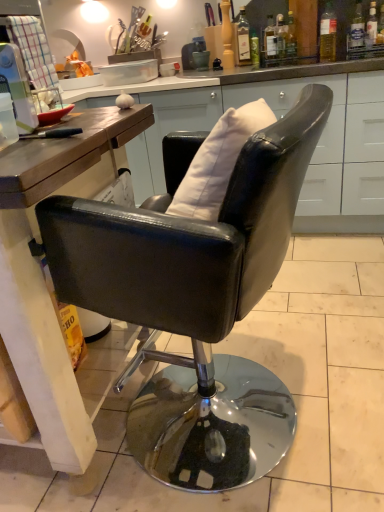
Question: Considering the relative sizes of clear glass bottle at upper right, which is the 2th bottle in right-to-left order, and black leather chair at center in the image provided, is clear glass bottle at upper right, which is the 2th bottle in right-to-left order, bigger than black leather chair at center?

Choices:
 (A) yes
 (B) no

Answer: (B)

Question: Does clear glass bottle at upper right, which ranks as the seventh bottle in left-to-right order, have a smaller size compared to black leather chair at center?

Choices:
 (A) no
 (B) yes

Answer: (B)

Question: Considering the relative positions of clear glass bottle at upper right, which ranks as the seventh bottle in left-to-right order, and black leather chair at center in the image provided, is clear glass bottle at upper right, which ranks as the seventh bottle in left-to-right order, to the left of black leather chair at center from the viewer's perspective?

Choices:
 (A) yes
 (B) no

Answer: (B)

Question: From a real-world perspective, is clear glass bottle at upper right, which ranks as the seventh bottle in left-to-right order, located higher than black leather chair at center?

Choices:
 (A) yes
 (B) no

Answer: (A)

Question: From the image's perspective, is clear glass bottle at upper right, which is the 2th bottle in right-to-left order, located above black leather chair at center?

Choices:
 (A) yes
 (B) no

Answer: (A)

Question: From the image's perspective, is translucent glass bottle at upper right, which is counted as the 3th bottle, starting from the left, positioned above or below matte wood countertop at center?

Choices:
 (A) below
 (B) above

Answer: (B)

Question: Is translucent glass bottle at upper right, the 6th bottle in the right-to-left sequence, wider or thinner than matte wood countertop at center?

Choices:
 (A) wide
 (B) thin

Answer: (B)

Question: In terms of height, does translucent glass bottle at upper right, the 6th bottle in the right-to-left sequence, look taller or shorter compared to matte wood countertop at center?

Choices:
 (A) tall
 (B) short

Answer: (B)

Question: Visually, is translucent glass bottle at upper right, the 6th bottle in the right-to-left sequence, positioned to the left or to the right of matte wood countertop at center?

Choices:
 (A) right
 (B) left

Answer: (A)

Question: Is point (332, 11) positioned closer to the camera than point (218, 155)?

Choices:
 (A) closer
 (B) farther

Answer: (B)

Question: In terms of width, does translucent glass bottle at upper right, which is the sixth bottle in left-to-right order, look wider or thinner when compared to white matte pillow at center?

Choices:
 (A) thin
 (B) wide

Answer: (A)

Question: Considering the positions of translucent glass bottle at upper right, which is the sixth bottle in left-to-right order, and white matte pillow at center in the image, is translucent glass bottle at upper right, which is the sixth bottle in left-to-right order, taller or shorter than white matte pillow at center?

Choices:
 (A) tall
 (B) short

Answer: (B)

Question: Based on their sizes in the image, would you say translucent glass bottle at upper right, acting as the 3th bottle starting from the right, is bigger or smaller than white matte pillow at center?

Choices:
 (A) small
 (B) big

Answer: (A)

Question: From a real-world perspective, relative to translucent glass bottle at upper right, which is the sixth bottle in left-to-right order, is translucent glass bottle at upper right, the 4th bottle positioned from the left, vertically above or below?

Choices:
 (A) below
 (B) above

Answer: (A)

Question: Choose the correct answer: Is translucent glass bottle at upper right, the 4th bottle positioned from the left, inside translucent glass bottle at upper right, which is the sixth bottle in left-to-right order, or outside it?

Choices:
 (A) outside
 (B) inside

Answer: (A)